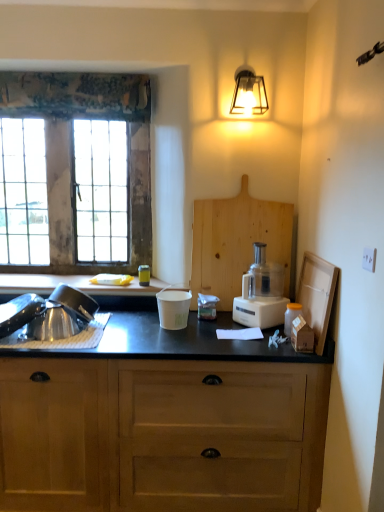
Locate an element on the screen. free point above black matte countertop at left (from a real-world perspective) is located at coordinates (75, 278).